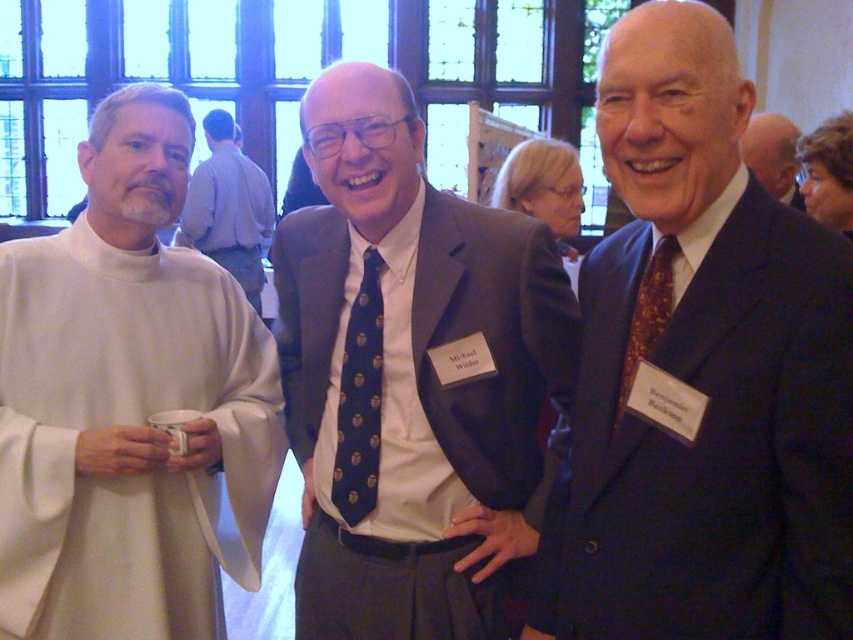
Consider the image. You are a photographer trying to adjust the lighting for a portrait. You notice the dark blue tie at center and the white cloth at left. Which object is closer to the camera lens?

The dark blue tie at center is closer to the camera lens because it is in front of the white cloth at left.

You are organizing a seating arrangement for a formal event and need to place the dark blue suit at center and the brown textured tie at right at a table. Considering their sizes, which one requires a wider seat?

The dark blue suit at center requires a wider seat since it has a larger size compared to the brown textured tie at right.